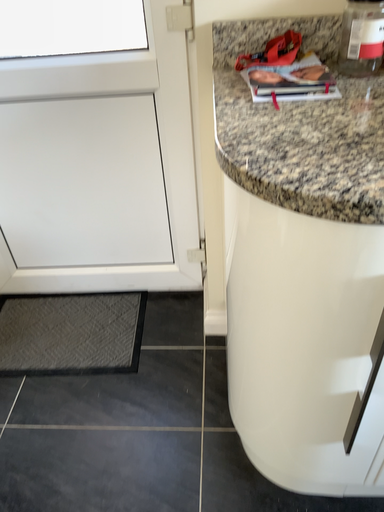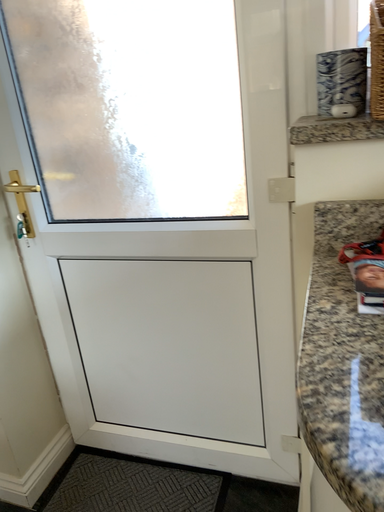
Question: How did the camera likely rotate when shooting the video?

Choices:
 (A) rotated upward
 (B) rotated downward

Answer: (A)